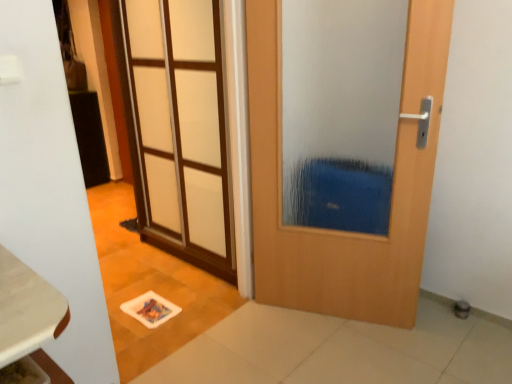
Question: Considering the positions of wooden door at center, which is counted as the first door, starting from the right, and white frosted glass door at upper left, which is counted as the first door, starting from the left, in the image, is wooden door at center, which is counted as the first door, starting from the right, taller or shorter than white frosted glass door at upper left, which is counted as the first door, starting from the left,?

Choices:
 (A) short
 (B) tall

Answer: (A)

Question: Is wooden door at center, the second door viewed from the left, inside the boundaries of white frosted glass door at upper left, which is counted as the first door, starting from the left, or outside?

Choices:
 (A) inside
 (B) outside

Answer: (B)

Question: Estimate the real-world distances between objects in this image. Which object is closer to the wooden table at lower left?

Choices:
 (A) wooden door at center, the second door viewed from the left
 (B) white frosted glass door at upper left, which is counted as the first door, starting from the left

Answer: (A)

Question: Estimate the real-world distances between objects in this image. Which object is farther from the wooden table at lower left?

Choices:
 (A) white frosted glass door at upper left, which is counted as the first door, starting from the left
 (B) wooden door at center, the second door viewed from the left

Answer: (A)